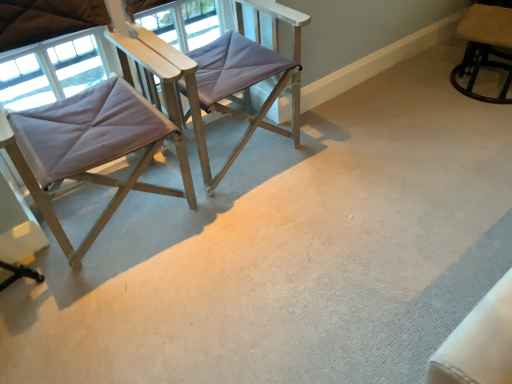
The image size is (512, 384). What are the coordinates of `free space to the back side of beige fabric chair at upper right, which is counted as the 3th chair, starting from the left` in the screenshot? It's located at (439, 61).